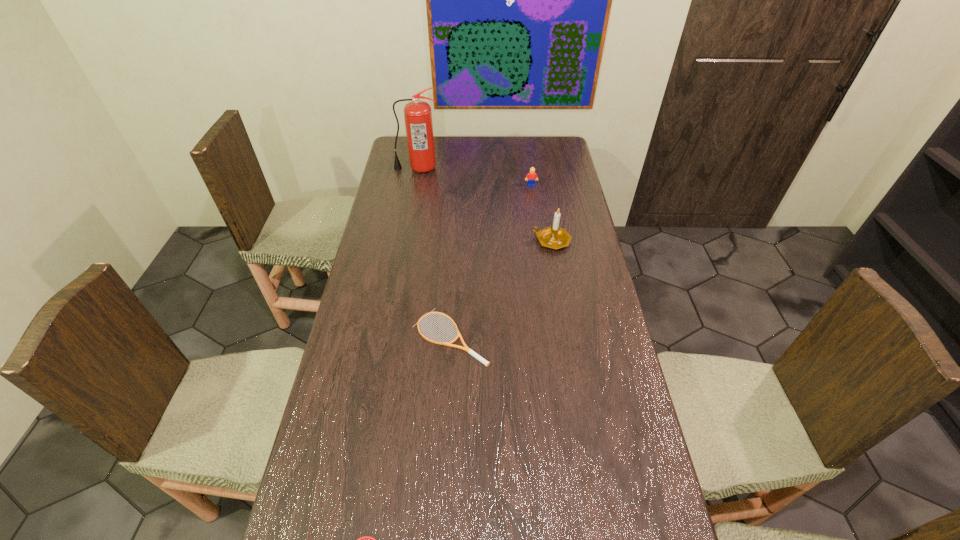
Find the location of `free space between the fire extinguisher and the candle holder`. free space between the fire extinguisher and the candle holder is located at coordinates (484, 205).

Identify the location of free point between the farthest object and the Lego. (474, 177).

You are a GUI agent. You are given a task and a screenshot of the screen. Output one action in this format:
    pyautogui.click(x=<x>, y=<y>)
    Task: Click on the blank region between the third farthest object and the second shortest object
    
    Given the screenshot: What is the action you would take?
    pyautogui.click(x=501, y=289)

The height and width of the screenshot is (540, 960). I want to click on vacant space that's between the farthest object and the third tallest object, so [474, 177].

Where is `the third closest object to the third nearest object`? This screenshot has height=540, width=960. the third closest object to the third nearest object is located at coordinates (417, 114).

Locate an element on the screen. object that is the nearest to the fourth shortest object is located at coordinates (532, 176).

The width and height of the screenshot is (960, 540). Find the location of `free location that satisfies the following two spatial constraints: 1. on the instruction side of the fire extinguisher; 2. on the left side of the farther tennis racket`. free location that satisfies the following two spatial constraints: 1. on the instruction side of the fire extinguisher; 2. on the left side of the farther tennis racket is located at coordinates (387, 337).

What are the coordinates of `free space that satisfies the following two spatial constraints: 1. on the instruction side of the farthest object; 2. on the left side of the farther tennis racket` in the screenshot? It's located at (387, 337).